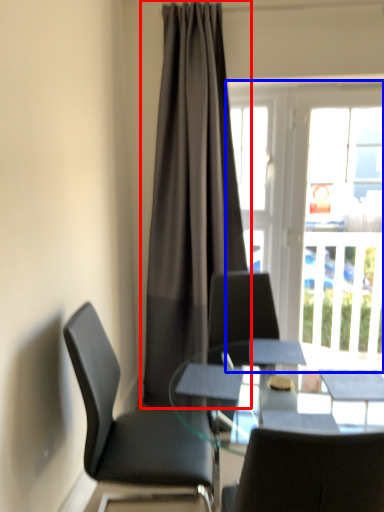
Question: Which point is further to the camera, curtain (highlighted by a red box) or window (highlighted by a blue box)?

Choices:
 (A) curtain
 (B) window

Answer: (B)